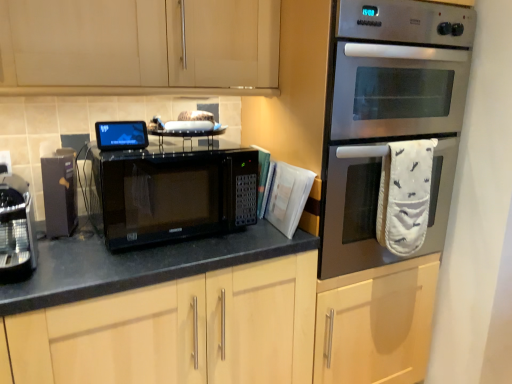
Where is `vacant area located to the right-hand side of matte black coffee machine at left, the 2th appliance positioned from the right`? The width and height of the screenshot is (512, 384). vacant area located to the right-hand side of matte black coffee machine at left, the 2th appliance positioned from the right is located at coordinates (91, 233).